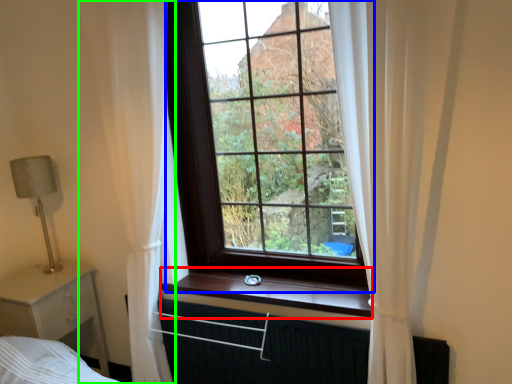
Question: Based on their relative distances, which object is farther from window sill (highlighted by a red box)? Choose from window (highlighted by a blue box) and curtain (highlighted by a green box).

Choices:
 (A) window
 (B) curtain

Answer: (B)